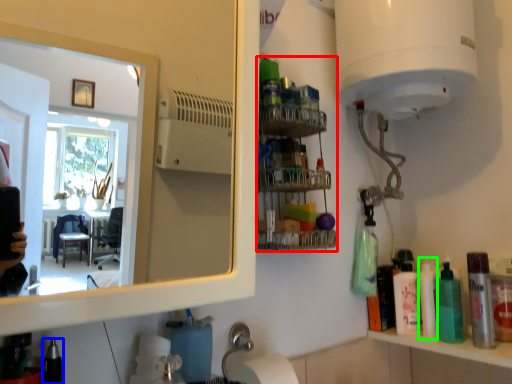
Question: Which is farther away from shelf (highlighted by a red box)? toiletry (highlighted by a blue box) or cleaning product (highlighted by a green box)?

Choices:
 (A) toiletry
 (B) cleaning product

Answer: (A)